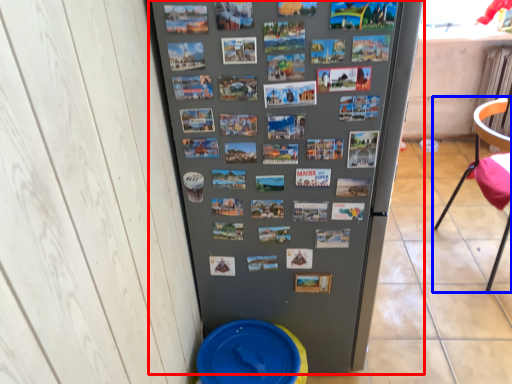
Question: Among these objects, which one is farthest to the camera, refrigerator (highlighted by a red box) or chair (highlighted by a blue box)?

Choices:
 (A) refrigerator
 (B) chair

Answer: (B)